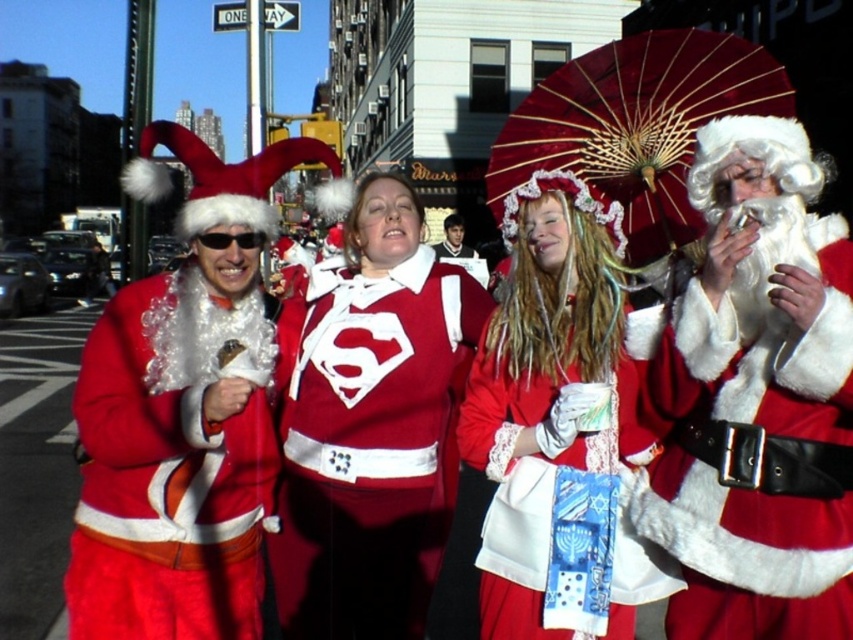
Image resolution: width=853 pixels, height=640 pixels. Describe the element at coordinates (757, 401) in the screenshot. I see `fuzzy white santa at center` at that location.

Does fuzzy white santa at center have a greater height compared to smooth brown leather jacket at center?

Correct, fuzzy white santa at center is much taller as smooth brown leather jacket at center.

You are a GUI agent. You are given a task and a screenshot of the screen. Output one action in this format:
    pyautogui.click(x=<x>, y=<y>)
    Task: Click on the fuzzy white santa at center
    The height and width of the screenshot is (640, 853).
    Given the screenshot: What is the action you would take?
    pyautogui.click(x=757, y=401)

Can you confirm if velvet red umbrella at upper right is positioned above smooth brown leather jacket at center?

Correct, velvet red umbrella at upper right is located above smooth brown leather jacket at center.

Which of these two, velvet red umbrella at upper right or smooth brown leather jacket at center, stands shorter?

smooth brown leather jacket at center is shorter.

Locate an element on the screen. velvet red umbrella at upper right is located at coordinates (631, 132).

Which is more to the left, fuzzy red santa claus at left or velvet red umbrella at upper right?

From the viewer's perspective, fuzzy red santa claus at left appears more on the left side.

Does fuzzy red santa claus at left appear on the right side of velvet red umbrella at upper right?

In fact, fuzzy red santa claus at left is to the left of velvet red umbrella at upper right.

Is point (260, 173) positioned behind point (714, 109)?

No, it is not.

You are a GUI agent. You are given a task and a screenshot of the screen. Output one action in this format:
    pyautogui.click(x=<x>, y=<y>)
    Task: Click on the fuzzy red santa claus at left
    
    Given the screenshot: What is the action you would take?
    pyautogui.click(x=184, y=412)